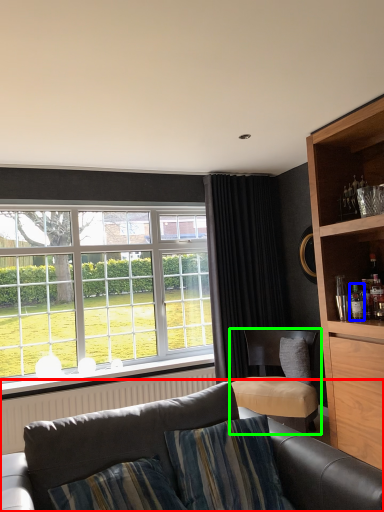
Question: Estimate the real-world distances between objects in this image. Which object is closer to studio couch (highlighted by a red box), bottle (highlighted by a blue box) or chair (highlighted by a green box)?

Choices:
 (A) bottle
 (B) chair

Answer: (B)